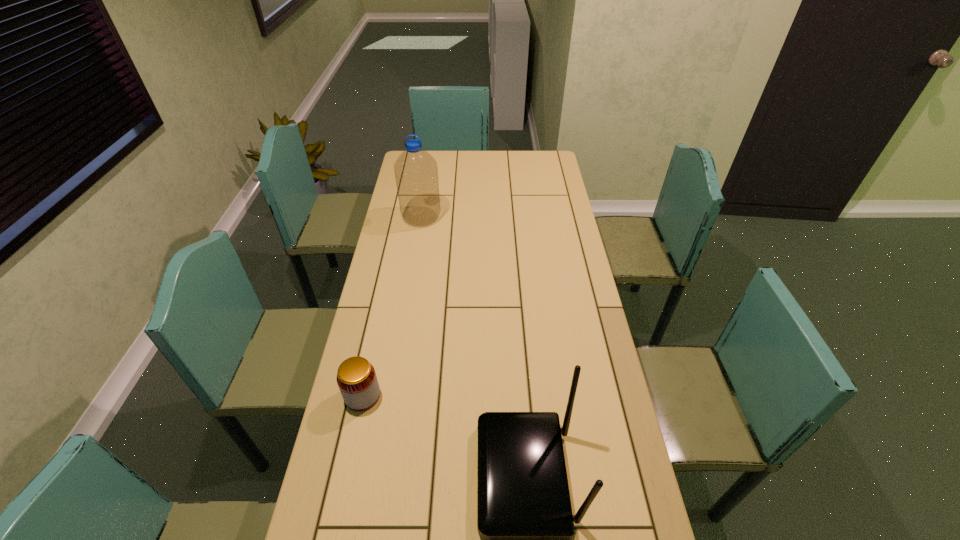
Where is `vacant space at the right edge of the desktop`? The height and width of the screenshot is (540, 960). vacant space at the right edge of the desktop is located at coordinates (643, 523).

Locate an element on the screen. The width and height of the screenshot is (960, 540). free space at the far right corner of the desktop is located at coordinates (532, 152).

This screenshot has width=960, height=540. Identify the location of vacant space in between the second farthest object and the tallest object. (392, 306).

Find the location of a particular element. Image resolution: width=960 pixels, height=540 pixels. unoccupied area between the jar and the farthest object is located at coordinates (392, 306).

I want to click on free point between the shortest object and the tallest object, so click(x=392, y=306).

This screenshot has width=960, height=540. In order to click on object that stands as the closest to the rightmost object in this screenshot , I will do `click(356, 377)`.

The height and width of the screenshot is (540, 960). What are the coordinates of `object that is the second closest to the jar` in the screenshot? It's located at (416, 172).